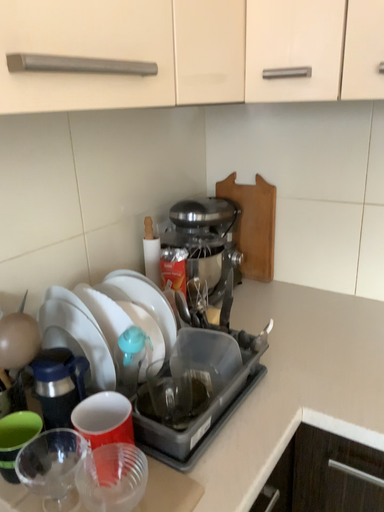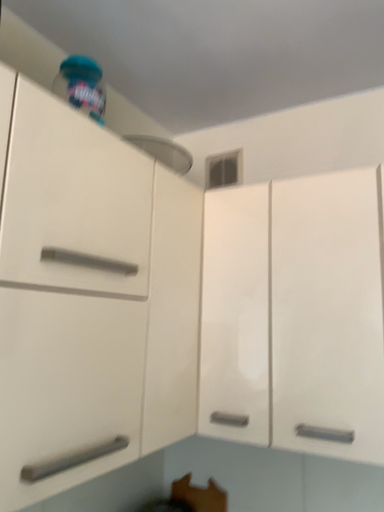
Question: How did the camera likely rotate when shooting the video?

Choices:
 (A) rotated upward
 (B) rotated downward

Answer: (A)